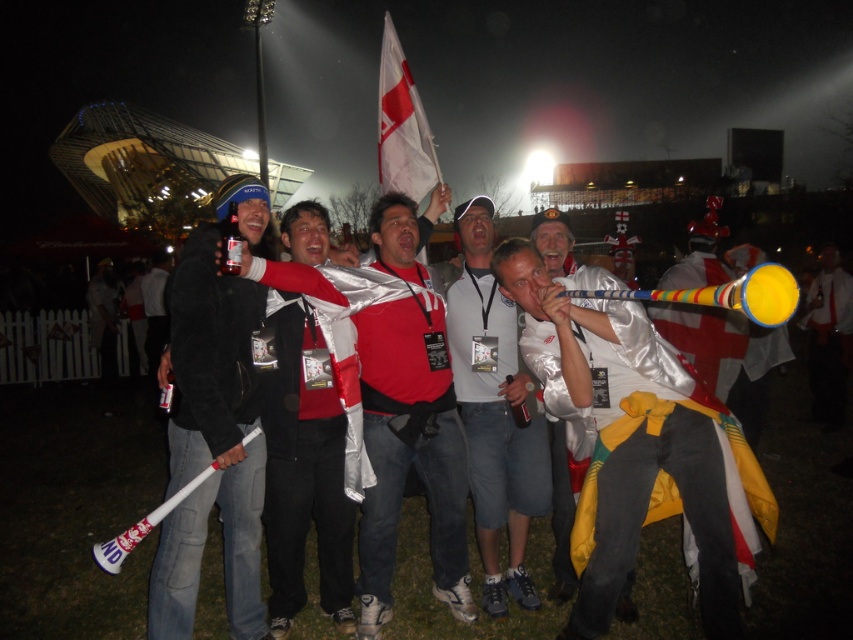
You are a photographer trying to capture a clear shot of the metallic silver flag at center and the white matte shirt at center. Since the scene is foggy, you need to adjust your camera focus. Which object should you focus on first to ensure it appears sharp in the photo?

The white matte shirt at center is taller than metallic silver flag at center, so focusing on the white matte shirt at center first would ensure it appears sharp due to its larger size in the frame.

You are a photographer trying to capture a clear shot of both the shiny silver jacket at center and the white fabric flag at upper center. Based on their positions, which object will appear smaller in your photo?

The shiny silver jacket at center will appear smaller in the photo because it has a lesser height compared to the white fabric flag at upper center.

You are a photographer at the event and want to capture both the white matte shirt at center and the metallic silver flag at center in a single frame. Which object should you focus on to ensure both are visible without cropping?

The white matte shirt at center occupies less space than the metallic silver flag at center, so focusing on the metallic silver flag at center will allow both objects to fit within the frame since it is larger and central.